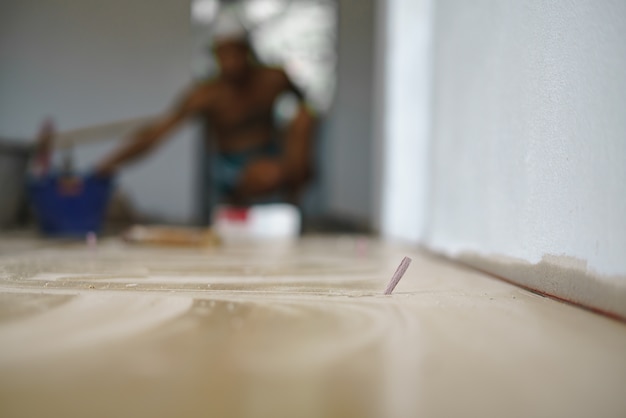
The width and height of the screenshot is (626, 418). I want to click on corner of room, so click(370, 76).